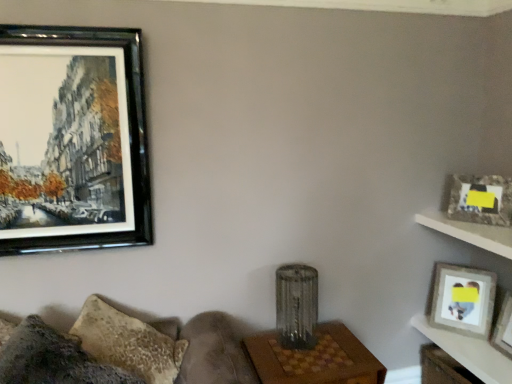
Find the location of a particular element. The width and height of the screenshot is (512, 384). unoccupied area in front of metallic textured lamp at center is located at coordinates pyautogui.click(x=303, y=374).